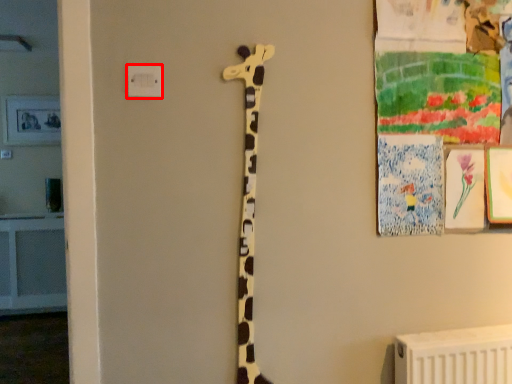
Question: In this image, where is electric outlet (annotated by the red box) located relative to giraffe?

Choices:
 (A) right
 (B) left

Answer: (B)